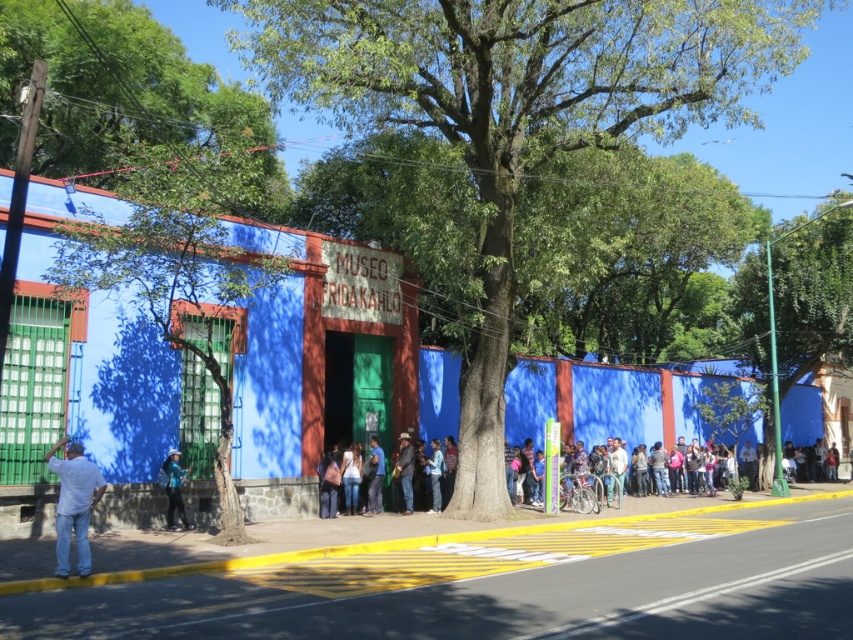
You are a visitor standing in front of the Museo Frida Kahlo. You notice the green leafy tree at center and the white asphalt road at center. Which object is taller?

The green leafy tree at center is taller than the white asphalt road at center according to the description.

You are a tourist standing on the sidewalk in front of the Museo Frida Kahlo. You see the green leafy tree at center and the white asphalt road at center. Which object is located to the right when facing the museum?

The green leafy tree at center is to the right of the white asphalt road at center, so the green leafy tree at center is located to the right when facing the museum.

You are a photographer standing at the entrance of the Museo Frida Kahlo. You want to capture a photo of the white cotton shirt at lower left and the white asphalt road at center in the same frame. Given that your camera has a maximum focus range of 10 meters, will both objects be in focus?

The white cotton shirt at lower left and white asphalt road at center are 10.05 meters apart. Since the distance exceeds the camera maximum focus range of 10 meters, both objects cannot be in focus at the same time.